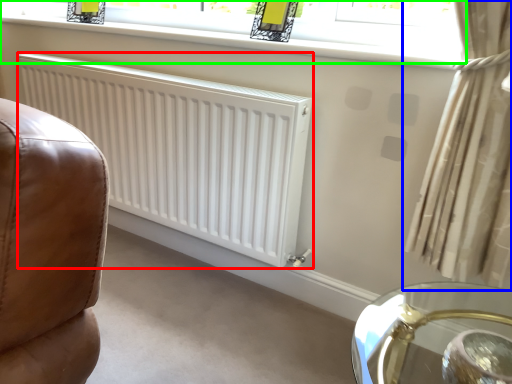
Question: Which is farther away from radiator (highlighted by a red box)? curtain (highlighted by a blue box) or window (highlighted by a green box)?

Choices:
 (A) curtain
 (B) window

Answer: (A)